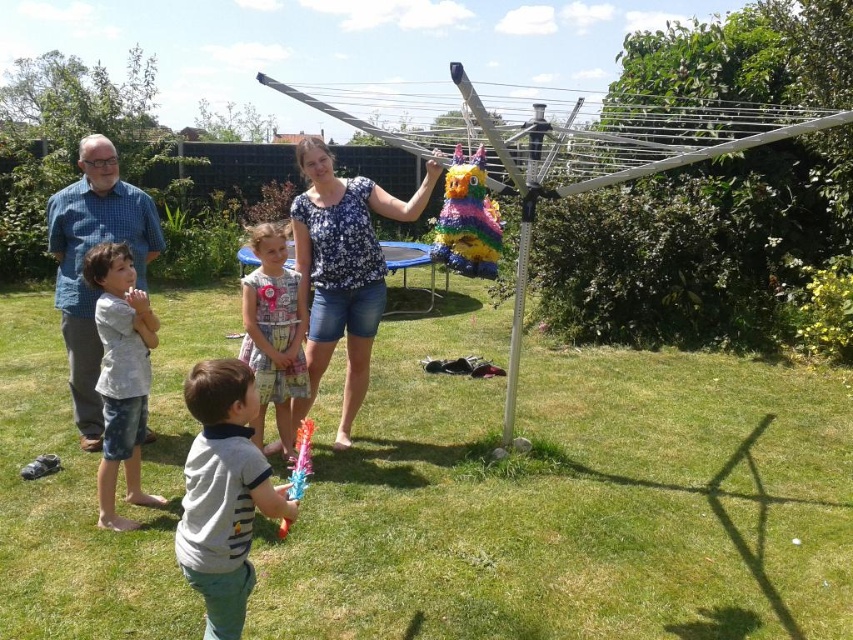
You are organizing a small picnic and need to decide which of the two shirts, the floral blouse at center or the gray cotton shirt at center, would be more suitable for sitting on the grass. Considering their materials and the activity, which one is better?

The gray cotton shirt at center is more suitable for sitting on grass because cotton is a breathable and durable material, making it ideal for outdoor activities like picnics. The floral blouse at center might be wider, suggesting it could be made of a less sturdy fabric like chiffon or lace, which might not hold up as well against grass.

You are a guest at the party and want to hand a gift to the person wearing the floral blouse at center without moving from your current position. Is the translucent plastic pinata at center blocking your direct line of sight to them?

The translucent plastic pinata at center is behind floral blouse at center, so the pinata is not blocking the direct line of sight. You can hand the gift directly to the floral blouse at center without any obstruction.

Based on the scene description, where is the floral blouse at center located in the image?

The floral blouse at center is located at point (x=341, y=269).